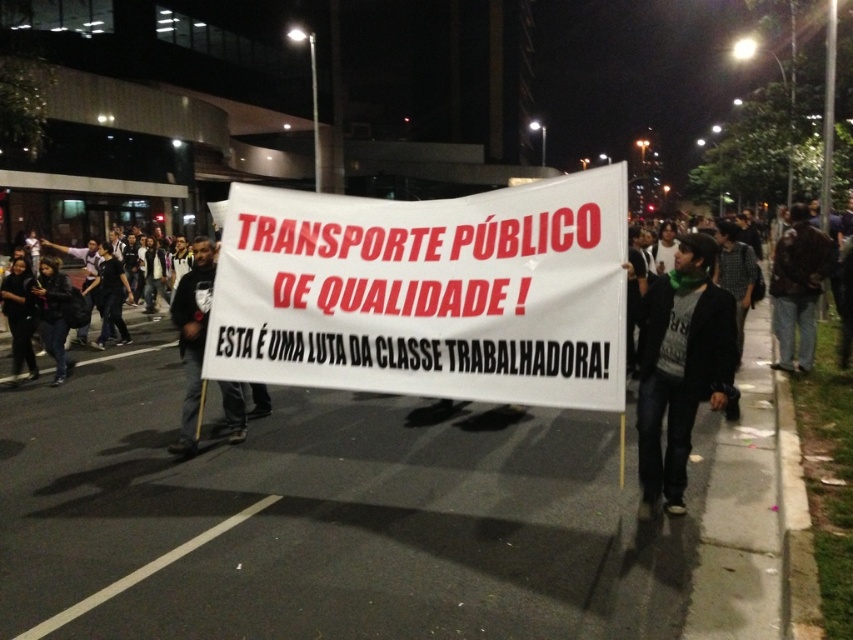
Question: Which point is farther from the camera taking this photo?

Choices:
 (A) (804, 308)
 (B) (386, 280)
 (C) (16, 381)
 (D) (640, 301)

Answer: (C)

Question: Does white paper banner at center come in front of black leather jacket at left?

Choices:
 (A) yes
 (B) no

Answer: (A)

Question: Can you confirm if white paper banner at center is wider than black leather jacket at left?

Choices:
 (A) no
 (B) yes

Answer: (B)

Question: Is black leather jacket at left to the left of dark brown leather jacket at right from the viewer's perspective?

Choices:
 (A) yes
 (B) no

Answer: (A)

Question: Which object is the closest to the green knitted scarf at center?

Choices:
 (A) black leather jacket at left
 (B) white paper banner at center
 (C) dark brown leather jacket at right

Answer: (B)

Question: Which is nearer to the white paper banner at center?

Choices:
 (A) green knitted scarf at center
 (B) dark brown leather jacket at right
 (C) black leather jacket at left

Answer: (A)